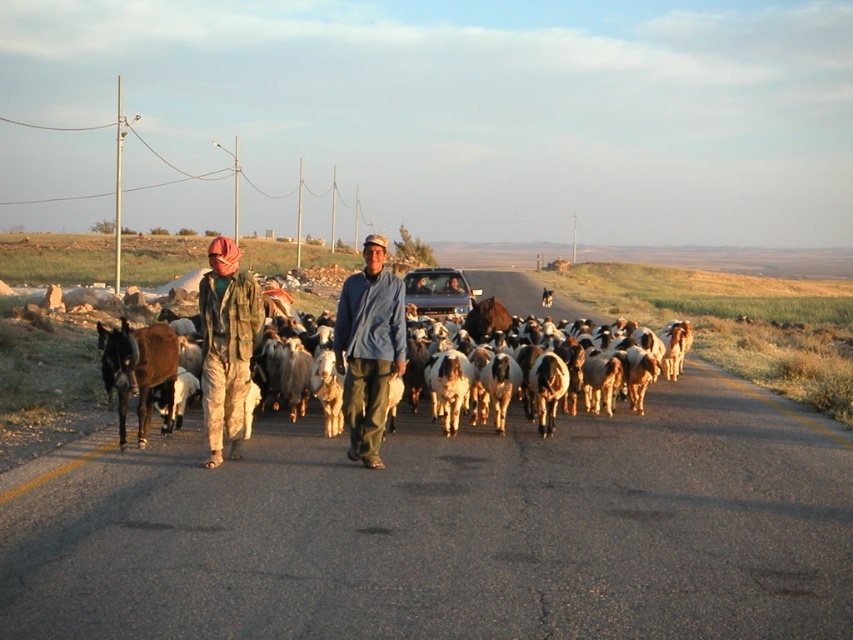
You are a photographer trying to capture a clear shot of the blue denim shirt at center and the camouflage fabric at left. Which one should you focus on first to ensure it appears sharp in your photo?

The blue denim shirt at center is closer to the viewer than the camouflage fabric at left, so you should focus on the blue denim shirt at center first to ensure it appears sharp.

You are a photographer trying to capture a photo of the white woolen goats at center and the metallic silver truck at center. Based on the scene, which object appears taller in the image?

The white woolen goats at center appears taller than the metallic silver truck at center in the image.